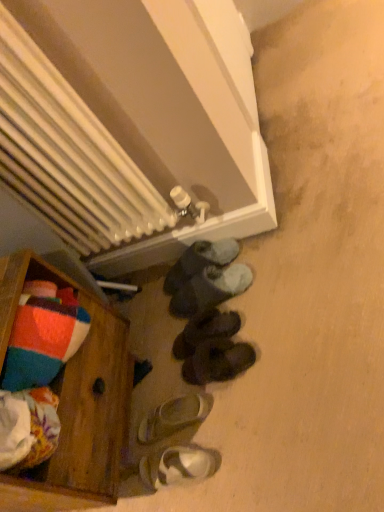
You are a GUI agent. You are given a task and a screenshot of the screen. Output one action in this format:
    pyautogui.click(x=<x>, y=<y>)
    Task: Click on the vacant area that is in front of black suede slippers at center, which appears as the 4th footwear when ordered from the bottom
    This screenshot has width=384, height=512.
    Given the screenshot: What is the action you would take?
    pyautogui.click(x=242, y=371)